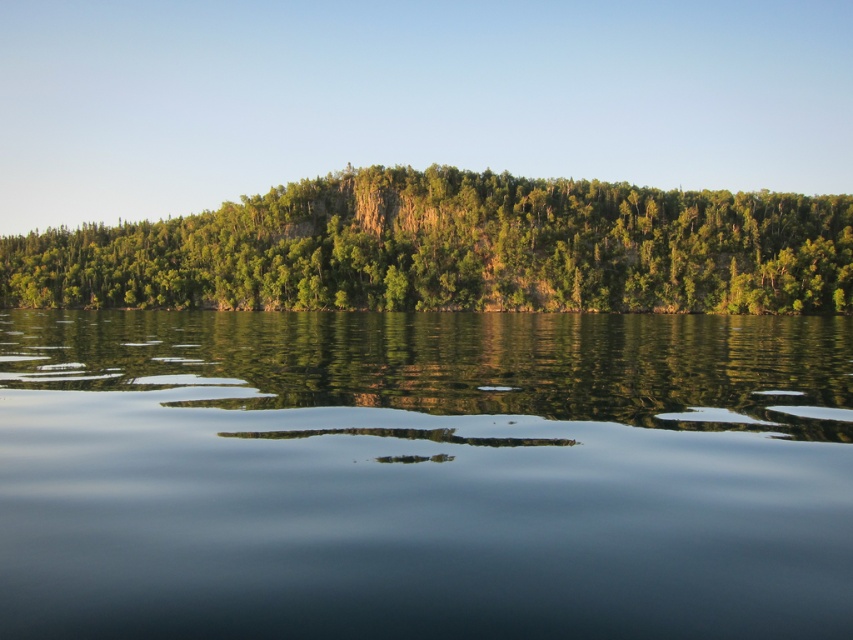
Is smooth dark water at center above green leafy trees at center?

No.

Is smooth dark water at center thinner than green leafy trees at center?

Yes.

Where is `smooth dark water at center`? The height and width of the screenshot is (640, 853). smooth dark water at center is located at coordinates (424, 474).